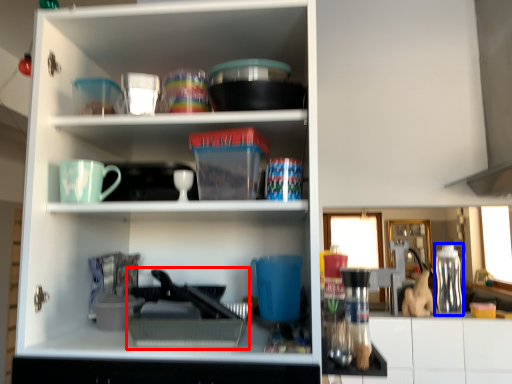
Question: Which object is further to the camera taking this photo, appliance (highlighted by a red box) or bottle (highlighted by a blue box)?

Choices:
 (A) appliance
 (B) bottle

Answer: (B)